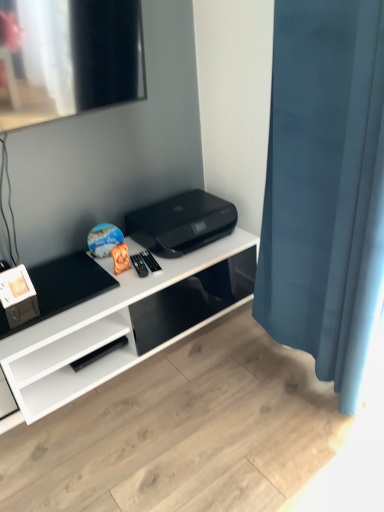
Question: Is blue velvet curtain at right taller than white glossy desk at center?

Choices:
 (A) yes
 (B) no

Answer: (A)

Question: Considering the relative sizes of blue velvet curtain at right and white glossy desk at center in the image provided, is blue velvet curtain at right smaller than white glossy desk at center?

Choices:
 (A) yes
 (B) no

Answer: (A)

Question: From a real-world perspective, does blue velvet curtain at right sit lower than white glossy desk at center?

Choices:
 (A) yes
 (B) no

Answer: (B)

Question: Is blue velvet curtain at right not inside white glossy desk at center?

Choices:
 (A) no
 (B) yes

Answer: (B)

Question: From the image's perspective, is blue velvet curtain at right under white glossy desk at center?

Choices:
 (A) no
 (B) yes

Answer: (A)

Question: Are blue velvet curtain at right and white glossy desk at center beside each other?

Choices:
 (A) no
 (B) yes

Answer: (A)

Question: Does white glossy desk at center come in front of blue velvet curtain at right?

Choices:
 (A) no
 (B) yes

Answer: (A)

Question: Does white glossy desk at center have a greater width compared to blue velvet curtain at right?

Choices:
 (A) yes
 (B) no

Answer: (A)

Question: Could you tell me if white glossy desk at center is turned towards blue velvet curtain at right?

Choices:
 (A) yes
 (B) no

Answer: (B)

Question: Considering the relative sizes of white glossy desk at center and blue velvet curtain at right in the image provided, is white glossy desk at center bigger than blue velvet curtain at right?

Choices:
 (A) yes
 (B) no

Answer: (A)

Question: Does white glossy desk at center have a lesser width compared to blue velvet curtain at right?

Choices:
 (A) yes
 (B) no

Answer: (B)

Question: Is white glossy desk at center to the right of blue velvet curtain at right from the viewer's perspective?

Choices:
 (A) no
 (B) yes

Answer: (A)

Question: From a real-world perspective, does blue velvet curtain at right stand above black plastic printer at center?

Choices:
 (A) no
 (B) yes

Answer: (B)